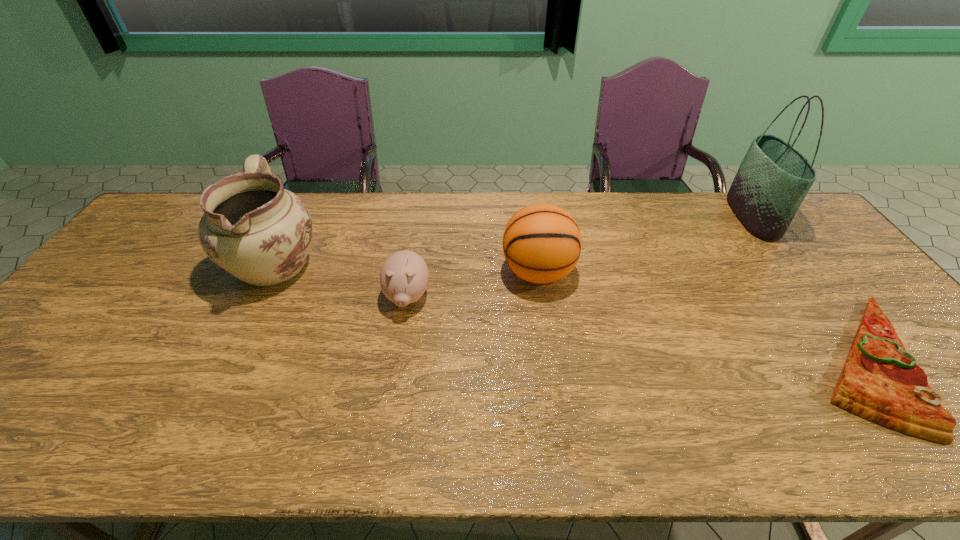
This screenshot has height=540, width=960. In order to click on the tallest object in this screenshot , I will do `click(774, 177)`.

Where is `the fourth shortest object`? The height and width of the screenshot is (540, 960). the fourth shortest object is located at coordinates (254, 229).

I want to click on the leftmost object, so click(254, 229).

Where is `the third tallest object`? The width and height of the screenshot is (960, 540). the third tallest object is located at coordinates (542, 243).

This screenshot has width=960, height=540. In order to click on basketball in this screenshot , I will do `click(542, 243)`.

Where is `the second shortest object`? This screenshot has height=540, width=960. the second shortest object is located at coordinates (404, 275).

In order to click on piggy bank in this screenshot , I will do `click(404, 275)`.

Where is `free spot located on the front of the tallest object`? The width and height of the screenshot is (960, 540). free spot located on the front of the tallest object is located at coordinates (817, 302).

Find the location of `vacant region located on the spout of the leftmost object`. vacant region located on the spout of the leftmost object is located at coordinates (195, 426).

Identify the location of free space located on the right of the third shortest object. This screenshot has width=960, height=540. (636, 272).